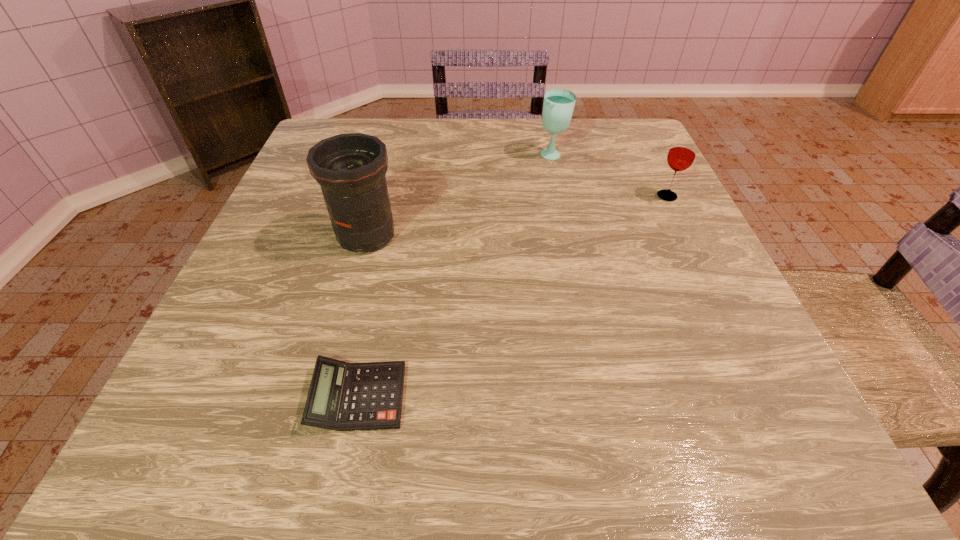
The height and width of the screenshot is (540, 960). In the image, there is a desktop. Find the location of `vacant space at the far right corner`. vacant space at the far right corner is located at coordinates (630, 151).

The width and height of the screenshot is (960, 540). Find the location of `vacant space at the near right corner of the desktop`. vacant space at the near right corner of the desktop is located at coordinates (787, 468).

Where is `vacant space that is in between the tallest object and the left glass`? vacant space that is in between the tallest object and the left glass is located at coordinates (460, 196).

Locate an element on the screen. The height and width of the screenshot is (540, 960). vacant area that lies between the shortest object and the nearer glass is located at coordinates (513, 296).

Identify the location of free area in between the shortest object and the telephoto lens. (363, 316).

You are a GUI agent. You are given a task and a screenshot of the screen. Output one action in this format:
    pyautogui.click(x=<x>, y=<y>)
    Task: Click on the free space between the telephoto lens and the third object from left to right
    Image resolution: width=960 pixels, height=540 pixels.
    Given the screenshot: What is the action you would take?
    pyautogui.click(x=460, y=196)

Image resolution: width=960 pixels, height=540 pixels. Find the location of `vacant space that's between the left glass and the shortest object`. vacant space that's between the left glass and the shortest object is located at coordinates (455, 276).

Where is `vacant region between the left glass and the shortest object`? vacant region between the left glass and the shortest object is located at coordinates (455, 276).

At what (x,y) coordinates should I click in order to perform the action: click on vacant space that is in between the farthest object and the rightmost object. Please return your answer as a coordinate pair (x, y). This screenshot has height=540, width=960. Looking at the image, I should click on (610, 176).

The height and width of the screenshot is (540, 960). What are the coordinates of `empty space between the third farthest object and the second farthest object` in the screenshot? It's located at (516, 216).